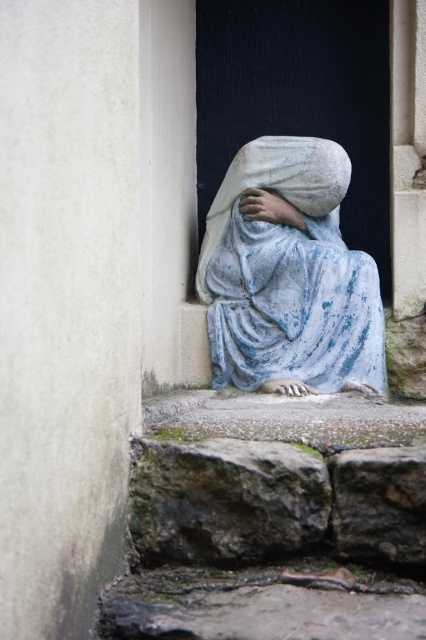
Question: Which of the following is the farthest from the observer?

Choices:
 (A) (256, 369)
 (B) (195, 580)

Answer: (A)

Question: Can you confirm if rough stone stairs at lower left is wider than blue stone statue at center?

Choices:
 (A) yes
 (B) no

Answer: (A)

Question: Which point is closer to the camera taking this photo?

Choices:
 (A) 331,449
 (B) 324,269

Answer: (A)

Question: Considering the relative positions of rough stone stairs at lower left and blue stone statue at center in the image provided, where is rough stone stairs at lower left located with respect to blue stone statue at center?

Choices:
 (A) below
 (B) above

Answer: (A)

Question: Can you confirm if rough stone stairs at lower left is smaller than blue stone statue at center?

Choices:
 (A) yes
 (B) no

Answer: (B)